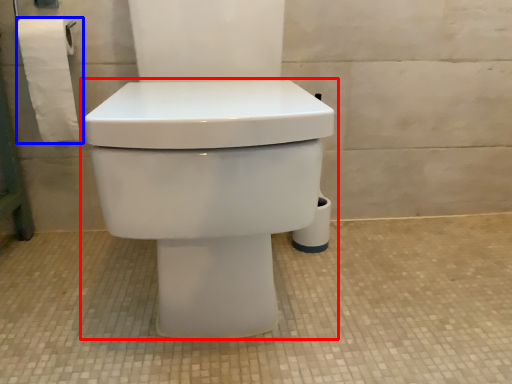
Question: Which object appears closest to the camera in this image, toilet (highlighted by a red box) or toilet paper (highlighted by a blue box)?

Choices:
 (A) toilet
 (B) toilet paper

Answer: (A)